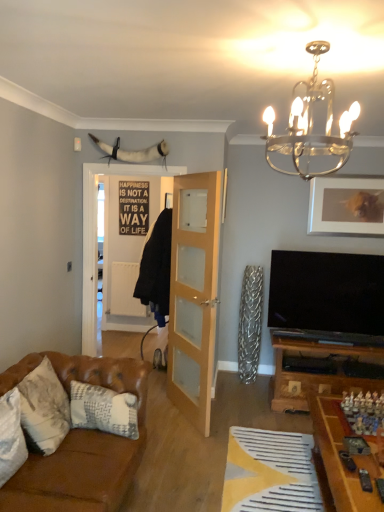
The image size is (384, 512). I want to click on leather couch at lower left, so 80,443.

What do you see at coordinates (44, 409) in the screenshot?
I see `leather pillow at left, placed as the second pillow when sorted from back to front` at bounding box center [44, 409].

What is the approximate width of wooden game board at lower right?

The width of wooden game board at lower right is 22.96 inches.

This screenshot has height=512, width=384. In order to click on wooden game board at lower right in this screenshot , I will do `click(341, 459)`.

What is the approximate width of white textured pillow at lower left, the 3th pillow when ordered from back to front?

It is 7.48 inches.

Describe the element at coordinates (194, 294) in the screenshot. I see `clear glass door at center` at that location.

Describe the element at coordinates (312, 125) in the screenshot. I see `metallic chandelier at upper center` at that location.

Find the location of a particular element. Image resolution: width=384 pixels, height=512 pixels. leather couch at lower left is located at coordinates (80, 443).

From a real-world perspective, relative to leather couch at lower left, is leather pillow at left, which is counted as the 2th pillow, starting from the front, vertically above or below?

leather pillow at left, which is counted as the 2th pillow, starting from the front, is above leather couch at lower left.

Is leather pillow at left, placed as the second pillow when sorted from back to front, surrounding leather couch at lower left?

Definitely not — leather couch at lower left is not inside leather pillow at left, placed as the second pillow when sorted from back to front.

Is leather pillow at left, which is counted as the 2th pillow, starting from the front, closer to camera compared to leather couch at lower left?

No, leather pillow at left, which is counted as the 2th pillow, starting from the front, is further to the viewer.

Is leather pillow at left, which is counted as the 2th pillow, starting from the front, smaller than leather couch at lower left?

Yes.

Is white textured pillow at lower left, which appears as the 1th pillow when viewed from the front, completely or partially outside of matte silver picture frame at upper right?

white textured pillow at lower left, which appears as the 1th pillow when viewed from the front, is positioned outside matte silver picture frame at upper right.

Is white textured pillow at lower left, which appears as the 1th pillow when viewed from the front, wider than matte silver picture frame at upper right?

Yes.

Considering the sizes of objects white textured pillow at lower left, the 3th pillow when ordered from back to front, and matte silver picture frame at upper right in the image provided, who is smaller, white textured pillow at lower left, the 3th pillow when ordered from back to front, or matte silver picture frame at upper right?

matte silver picture frame at upper right.

Considering the positions of objects leather pillow at left, placed as the second pillow when sorted from back to front, and white textured pillow at lower left, acting as the 1th pillow starting from the back, in the image provided, who is more to the right, leather pillow at left, placed as the second pillow when sorted from back to front, or white textured pillow at lower left, acting as the 1th pillow starting from the back,?

Positioned to the right is white textured pillow at lower left, acting as the 1th pillow starting from the back.

Is leather pillow at left, which is counted as the 2th pillow, starting from the front, facing away from white textured pillow at lower left, positioned as the 3th pillow in front-to-back order?

No.

From the image's perspective, relative to white textured pillow at lower left, positioned as the 3th pillow in front-to-back order, is leather pillow at left, placed as the second pillow when sorted from back to front, above or below?

From the image's perspective, leather pillow at left, placed as the second pillow when sorted from back to front, appears above white textured pillow at lower left, positioned as the 3th pillow in front-to-back order.

Which object is further away from the camera, black matte signboard at center or matte silver picture frame at upper right?

black matte signboard at center is behind.

Is black matte signboard at center taller than matte silver picture frame at upper right?

Correct, black matte signboard at center is much taller as matte silver picture frame at upper right.

In the image, is black matte signboard at center on the left side or the right side of matte silver picture frame at upper right?

Based on their positions, black matte signboard at center is located to the left of matte silver picture frame at upper right.

How different are the orientations of black matte signboard at center and matte silver picture frame at upper right in degrees?

0.0699 degrees separate the facing orientations of black matte signboard at center and matte silver picture frame at upper right.

In terms of height, does white textured pillow at lower left, positioned as the 3th pillow in front-to-back order, look taller or shorter compared to white textured pillow at lower left, the 3th pillow when ordered from back to front?

white textured pillow at lower left, positioned as the 3th pillow in front-to-back order, is taller than white textured pillow at lower left, the 3th pillow when ordered from back to front.

Considering the positions of objects white textured pillow at lower left, acting as the 1th pillow starting from the back, and white textured pillow at lower left, the 3th pillow when ordered from back to front, in the image provided, who is more to the left, white textured pillow at lower left, acting as the 1th pillow starting from the back, or white textured pillow at lower left, the 3th pillow when ordered from back to front,?

white textured pillow at lower left, the 3th pillow when ordered from back to front, is more to the left.

From the image's perspective, is white textured pillow at lower left, positioned as the 3th pillow in front-to-back order, over white textured pillow at lower left, which appears as the 1th pillow when viewed from the front?

Incorrect, from the image's perspective, white textured pillow at lower left, positioned as the 3th pillow in front-to-back order, is lower than white textured pillow at lower left, which appears as the 1th pillow when viewed from the front.

Considering the points (91, 401) and (12, 468), which point is in front, point (91, 401) or point (12, 468)?

Positioned in front is point (12, 468).

Which is more distant, (0,470) or (58,405)?

Positioned behind is point (58,405).

Is white textured pillow at lower left, the 3th pillow when ordered from back to front, to the right of leather pillow at left, which is counted as the 2th pillow, starting from the front, from the viewer's perspective?

No, white textured pillow at lower left, the 3th pillow when ordered from back to front, is not to the right of leather pillow at left, which is counted as the 2th pillow, starting from the front.

Can leather pillow at left, which is counted as the 2th pillow, starting from the front, be found inside white textured pillow at lower left, which appears as the 1th pillow when viewed from the front?

No, leather pillow at left, which is counted as the 2th pillow, starting from the front, is not surrounded by white textured pillow at lower left, which appears as the 1th pillow when viewed from the front.

In terms of height, does white textured pillow at lower left, the 3th pillow when ordered from back to front, look taller or shorter compared to leather pillow at left, which is counted as the 2th pillow, starting from the front?

In the image, white textured pillow at lower left, the 3th pillow when ordered from back to front, appears to be shorter than leather pillow at left, which is counted as the 2th pillow, starting from the front.

Can you tell me how much black matte signboard at center and white textured pillow at lower left, positioned as the 3th pillow in front-to-back order, differ in facing direction?

black matte signboard at center and white textured pillow at lower left, positioned as the 3th pillow in front-to-back order, are facing 0.838 degrees away from each other.

Is black matte signboard at center with white textured pillow at lower left, positioned as the 3th pillow in front-to-back order?

Answer: No, black matte signboard at center is not in contact with white textured pillow at lower left, positioned as the 3th pillow in front-to-back order.

Between black matte signboard at center and white textured pillow at lower left, acting as the 1th pillow starting from the back, which one has larger size?

Bigger between the two is white textured pillow at lower left, acting as the 1th pillow starting from the back.

Considering the relative positions of black matte signboard at center and white textured pillow at lower left, positioned as the 3th pillow in front-to-back order, in the image provided, is black matte signboard at center to the right of white textured pillow at lower left, positioned as the 3th pillow in front-to-back order, from the viewer's perspective?

In fact, black matte signboard at center is to the left of white textured pillow at lower left, positioned as the 3th pillow in front-to-back order.

The height and width of the screenshot is (512, 384). Find the location of `studio couch on the right of leather pillow at left, which is counted as the 2th pillow, starting from the front`. studio couch on the right of leather pillow at left, which is counted as the 2th pillow, starting from the front is located at coordinates (80, 443).

You are a GUI agent. You are given a task and a screenshot of the screen. Output one action in this format:
    pyautogui.click(x=<x>, y=<y>)
    Task: Click on the 3rd pillow to the left when counting from the matte silver picture frame at upper right
    The width and height of the screenshot is (384, 512).
    Given the screenshot: What is the action you would take?
    pyautogui.click(x=11, y=436)

Which object lies further to the anchor point metallic chandelier at upper center, white textured pillow at lower left, which appears as the 1th pillow when viewed from the front, or wooden game board at lower right?

white textured pillow at lower left, which appears as the 1th pillow when viewed from the front, lies further to metallic chandelier at upper center than the other object.

Which object lies further to the anchor point wooden game board at lower right, leather pillow at left, which is counted as the 2th pillow, starting from the front, or white textured pillow at lower left, which appears as the 1th pillow when viewed from the front?

Based on the image, white textured pillow at lower left, which appears as the 1th pillow when viewed from the front, appears to be further to wooden game board at lower right.

When comparing their distances from leather pillow at left, placed as the second pillow when sorted from back to front, does leather couch at lower left or metallic chandelier at upper center seem further?

The object further to leather pillow at left, placed as the second pillow when sorted from back to front, is metallic chandelier at upper center.

Looking at the image, which one is located further to white textured pillow at lower left, which appears as the 1th pillow when viewed from the front, metallic chandelier at upper center or yellow fabric at lower center?

metallic chandelier at upper center.

Looking at the image, which one is located further to clear glass door at center, leather couch at lower left or yellow fabric at lower center?

Among the two, leather couch at lower left is located further to clear glass door at center.

From the image, which object appears to be nearer to white textured pillow at lower left, the 3th pillow when ordered from back to front, black matte signboard at center or yellow fabric at lower center?

The object closer to white textured pillow at lower left, the 3th pillow when ordered from back to front, is yellow fabric at lower center.

From the image, which object appears to be nearer to leather couch at lower left, matte silver picture frame at upper right or clear glass door at center?

Based on the image, clear glass door at center appears to be nearer to leather couch at lower left.

Based on their spatial positions, is white textured pillow at lower left, the 3th pillow when ordered from back to front, or leather couch at lower left further from yellow fabric at lower center?

Among the two, white textured pillow at lower left, the 3th pillow when ordered from back to front, is located further to yellow fabric at lower center.

You are a GUI agent. You are given a task and a screenshot of the screen. Output one action in this format:
    pyautogui.click(x=<x>, y=<y>)
    Task: Click on the picture frame between leather pillow at left, placed as the second pillow when sorted from back to front, and black matte signboard at center from front to back
    
    Given the screenshot: What is the action you would take?
    pyautogui.click(x=346, y=206)

At what (x,y) coordinates should I click in order to perform the action: click on plain between wooden game board at lower right and matte silver picture frame at upper right from front to back. Please return your answer as a coordinate pair (x, y). The height and width of the screenshot is (512, 384). Looking at the image, I should click on point(270,472).

Where is `door between metallic chandelier at upper center and yellow fabric at lower center from top to bottom`? door between metallic chandelier at upper center and yellow fabric at lower center from top to bottom is located at coordinates (194, 294).

I want to click on door that lies between matte silver picture frame at upper right and yellow fabric at lower center from top to bottom, so click(x=194, y=294).